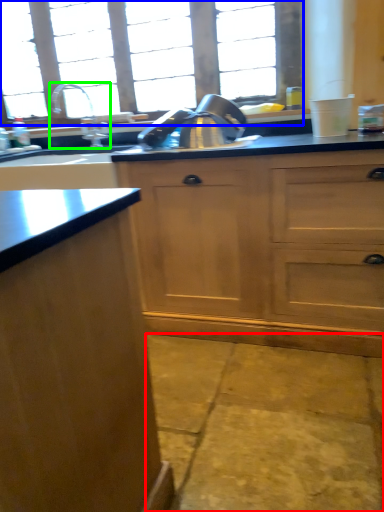
Question: Based on their relative distances, which object is nearer to concrete (highlighted by a red box)? Choose from window (highlighted by a blue box) and tap (highlighted by a green box).

Choices:
 (A) window
 (B) tap

Answer: (B)